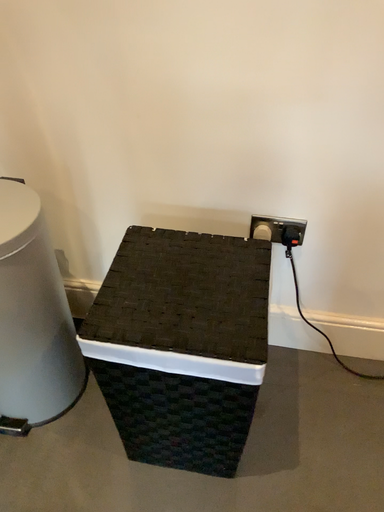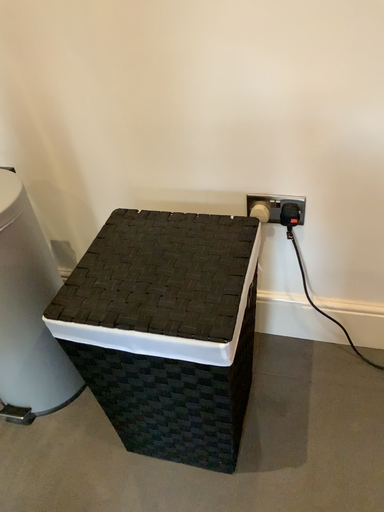
Question: How did the camera likely rotate when shooting the video?

Choices:
 (A) rotated right
 (B) rotated left

Answer: (B)